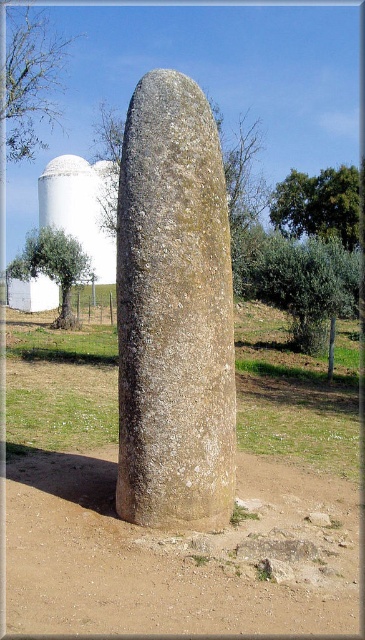
How distant is brown sandy dirt at center from green leafy tree at upper right?

brown sandy dirt at center is 27.03 feet from green leafy tree at upper right.

Which is more to the left, brown sandy dirt at center or green leafy tree at upper right?

Positioned to the left is brown sandy dirt at center.

Is point (243, 451) positioned behind point (273, 218)?

No, (243, 451) is in front of (273, 218).

I want to click on brown sandy dirt at center, so click(x=186, y=532).

Who is shorter, white smooth water tower at left or green leafy tree at left?

green leafy tree at left

Between white smooth water tower at left and green leafy tree at left, which one is positioned higher?

white smooth water tower at left is above.

Which is in front, point (50, 205) or point (55, 282)?

Positioned in front is point (55, 282).

At what (x,y) coordinates should I click in order to perform the action: click on white smooth water tower at left. Please return your answer as a coordinate pair (x, y). This screenshot has width=365, height=640. Looking at the image, I should click on (78, 209).

From the picture: Which is above, speckled stone monolith at center or green leafy tree at left?

green leafy tree at left is above.

Consider the image. Can you confirm if speckled stone monolith at center is positioned to the left of green leafy tree at left?

No, speckled stone monolith at center is not to the left of green leafy tree at left.

Between point (118, 419) and point (52, 266), which one is positioned in front?

Positioned in front is point (118, 419).

The image size is (365, 640). Find the location of `speckled stone monolith at center`. speckled stone monolith at center is located at coordinates (174, 312).